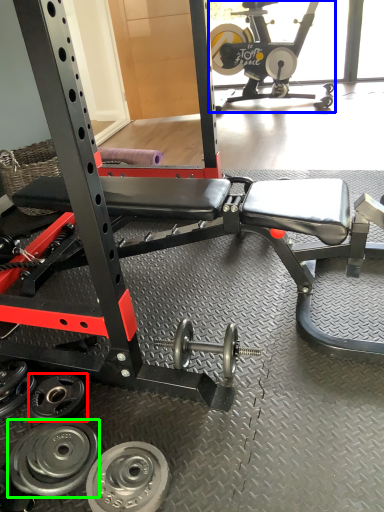
Question: Estimate the real-world distances between objects in this image. Which object is closer to wheel (highlighted by a red box), sport equipment (highlighted by a blue box) or wheel (highlighted by a green box)?

Choices:
 (A) sport equipment
 (B) wheel

Answer: (B)